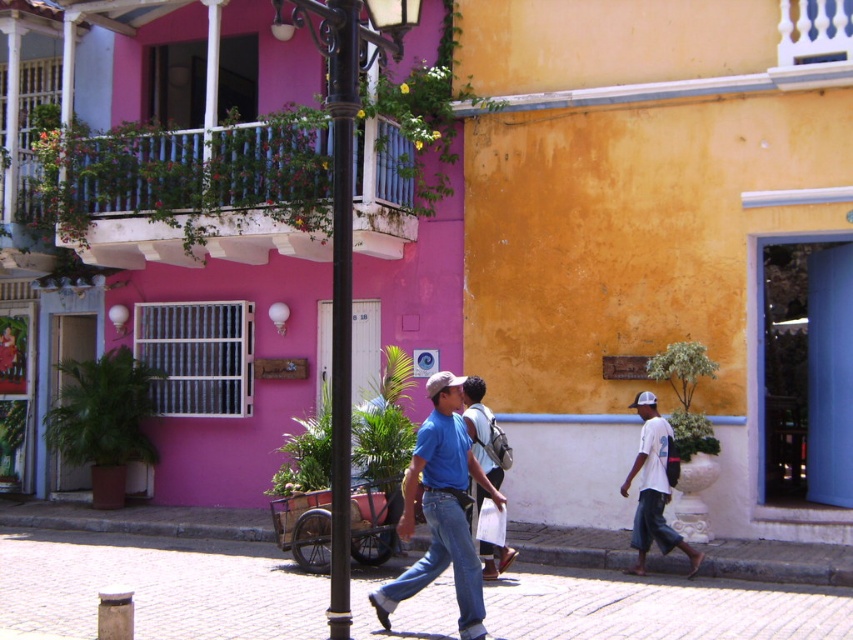
Question: Which object is positioned farthest from the white cotton shirt at right?

Choices:
 (A) black metal pole at center
 (B) blue denim jeans at center

Answer: (A)

Question: Which object appears closest to the camera in this image?

Choices:
 (A) brick pavement at center
 (B) white cotton shirt at right

Answer: (A)

Question: Where is black metal pole at center located in relation to white cotton shirt at right in the image?

Choices:
 (A) left
 (B) right

Answer: (A)

Question: Is black metal lamp post at center further to the viewer compared to matte blue shirt at center?

Choices:
 (A) yes
 (B) no

Answer: (B)

Question: Does black metal lamp post at center have a smaller size compared to matte blue shirt at center?

Choices:
 (A) yes
 (B) no

Answer: (B)

Question: Which object is farther from the camera taking this photo?

Choices:
 (A) blue denim jeans at center
 (B) brick pavement at center
 (C) matte blue shirt at center
 (D) white cotton shirt at right

Answer: (D)